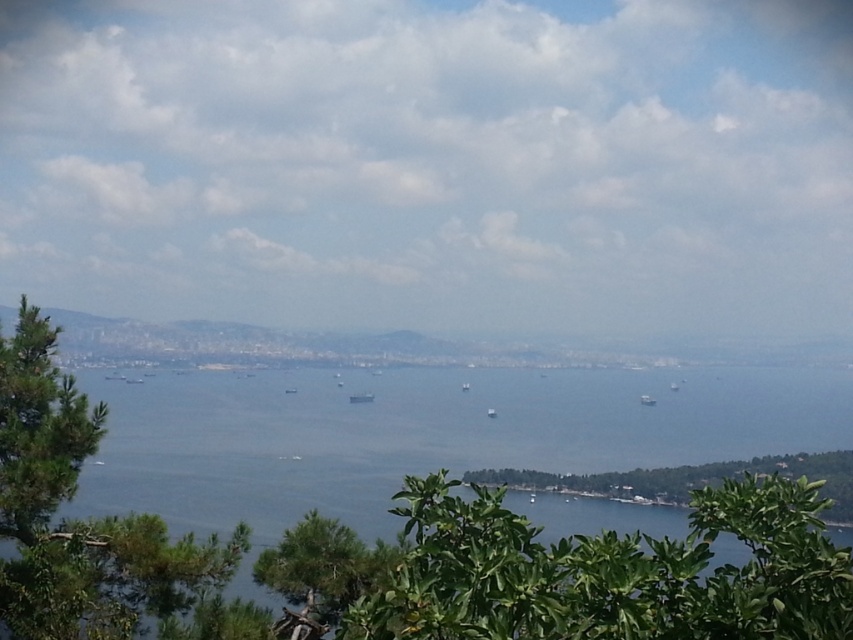
Is blue water at center taller than green leafy bush at lower right?

Yes.

Who is shorter, blue water at center or green leafy bush at lower right?

Standing shorter between the two is green leafy bush at lower right.

Who is more distant from viewer, (209, 451) or (599, 486)?

Point (209, 451)

Image resolution: width=853 pixels, height=640 pixels. Find the location of `blue water at center`. blue water at center is located at coordinates (422, 435).

In the scene shown: How distant is green leafy tree at left from green leafy bush at lower right?

43.00 meters

Can you confirm if green leafy tree at left is positioned to the left of green leafy bush at lower right?

Yes, green leafy tree at left is to the left of green leafy bush at lower right.

Between point (28, 611) and point (680, 476), which one is positioned in front?

Point (28, 611) is more forward.

Find the location of `green leafy tree at left`. green leafy tree at left is located at coordinates (83, 522).

Is blue water at center above green leafy tree at left?

Actually, blue water at center is below green leafy tree at left.

Who is shorter, blue water at center or green leafy tree at left?

Standing shorter between the two is green leafy tree at left.

The width and height of the screenshot is (853, 640). I want to click on blue water at center, so click(x=422, y=435).